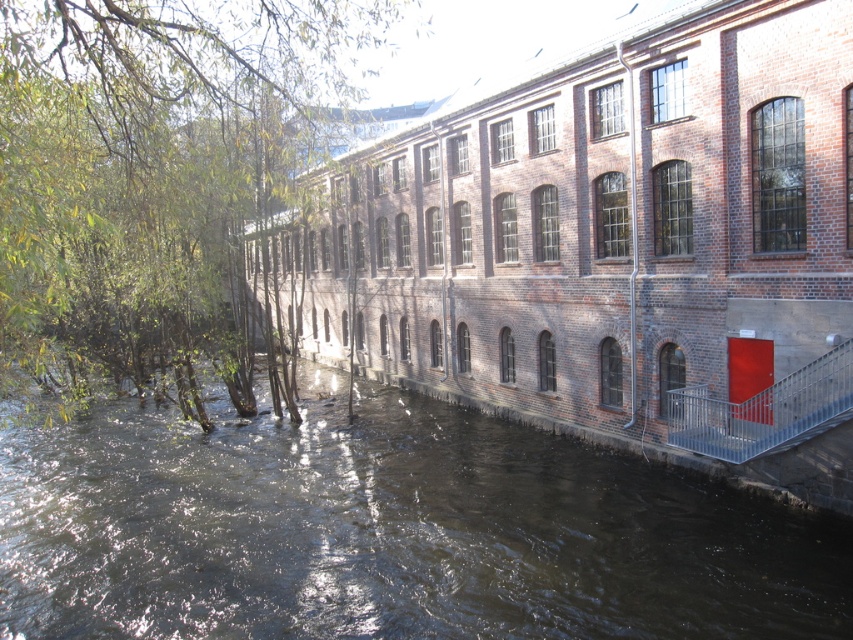
You are a tourist standing on the riverbank and want to take a photo of the green leafy tree at left and the metallic silver railing at lower right. Which object should you focus on first to ensure both are in the frame?

You should focus on the green leafy tree at left first because it is in front of the metallic silver railing at lower right, so adjusting the camera to include the tree will naturally include the railing behind it.

You are standing at the camera position and want to water the green leafy tree at left. If your watering can has a range of 4 meters, can you reach the tree without moving closer?

The green leafy tree at left and the camera are 4.51 meters apart, which is beyond the watering can range of 4 meters. You need to move closer to reach the tree.